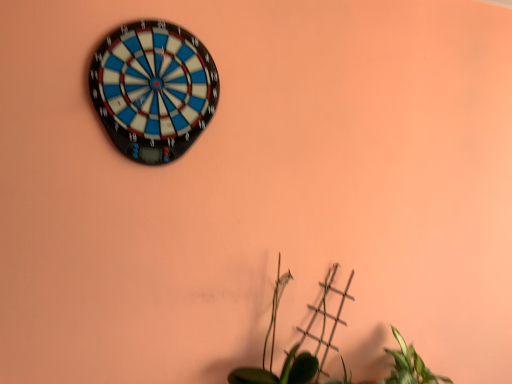
Question: From a real-world perspective, is blue plastic dartboard at upper left physically located above or below green matte plant at lower center?

Choices:
 (A) above
 (B) below

Answer: (A)

Question: From the image's perspective, is blue plastic dartboard at upper left located above or below green matte plant at lower center?

Choices:
 (A) below
 (B) above

Answer: (B)

Question: Would you say blue plastic dartboard at upper left is to the left or to the right of green matte plant at lower center in the picture?

Choices:
 (A) right
 (B) left

Answer: (B)

Question: In terms of width, does green matte plant at lower center look wider or thinner when compared to blue plastic dartboard at upper left?

Choices:
 (A) thin
 (B) wide

Answer: (B)

Question: In terms of height, does green matte plant at lower center look taller or shorter compared to blue plastic dartboard at upper left?

Choices:
 (A) tall
 (B) short

Answer: (B)

Question: Considering the positions of green matte plant at lower center and blue plastic dartboard at upper left in the image, is green matte plant at lower center bigger or smaller than blue plastic dartboard at upper left?

Choices:
 (A) big
 (B) small

Answer: (A)

Question: Considering the positions of point (294, 360) and point (199, 71), is point (294, 360) closer or farther from the camera than point (199, 71)?

Choices:
 (A) farther
 (B) closer

Answer: (A)